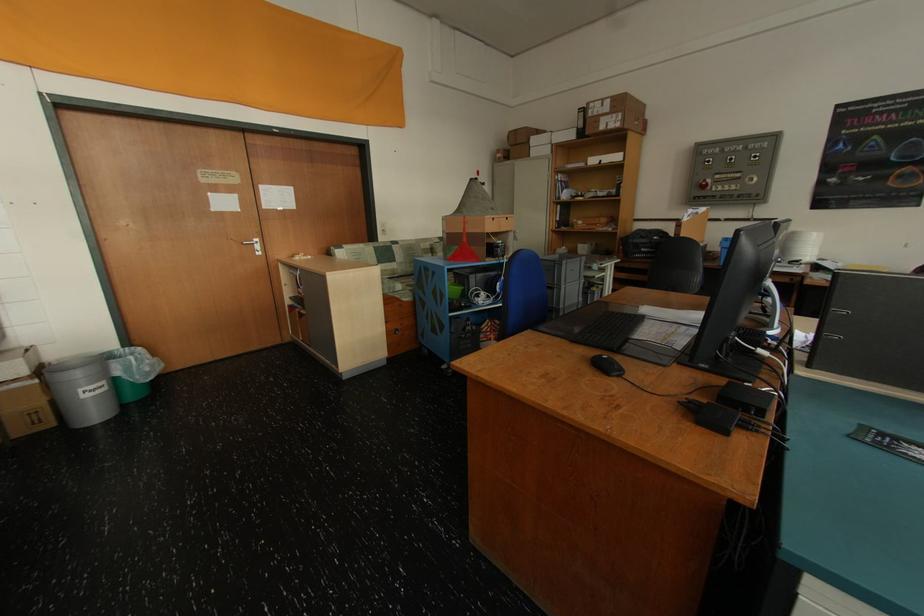
I want to click on red button, so click(x=703, y=184).